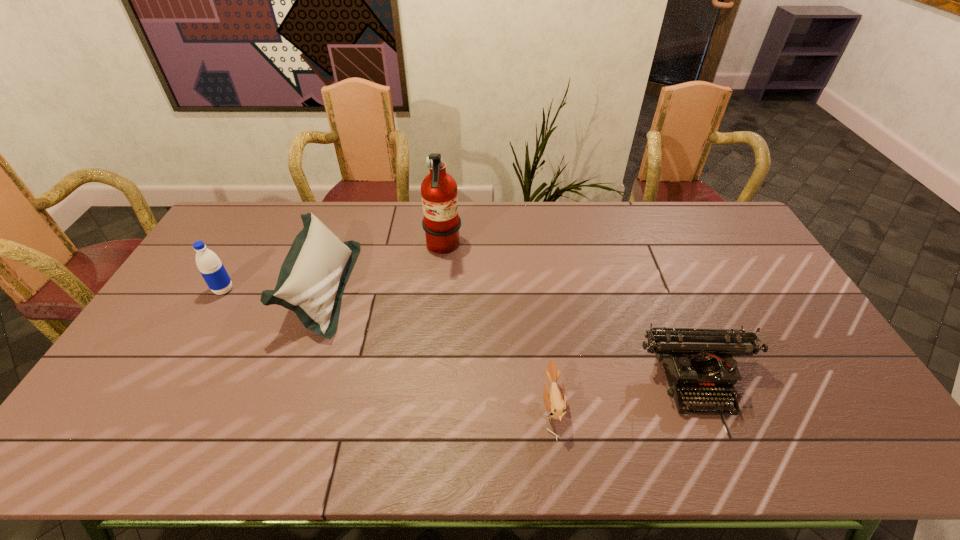
Locate an element on the screen. the tallest object is located at coordinates (441, 223).

Where is `fire extinguisher`? The image size is (960, 540). fire extinguisher is located at coordinates (441, 223).

I want to click on water bottle, so click(x=211, y=268).

Identify the location of cushion. (312, 278).

You are a GUI agent. You are given a task and a screenshot of the screen. Output one action in this format:
    pyautogui.click(x=<x>, y=<y>)
    Task: Click on the second shortest object
    The image size is (960, 540).
    Given the screenshot: What is the action you would take?
    pyautogui.click(x=695, y=361)

Find the location of a particular element. The height and width of the screenshot is (540, 960). the rightmost object is located at coordinates (695, 361).

Where is `the fourth object from left to right`? The width and height of the screenshot is (960, 540). the fourth object from left to right is located at coordinates (555, 402).

The width and height of the screenshot is (960, 540). I want to click on the shortest object, so click(555, 402).

You are a GUI agent. You are given a task and a screenshot of the screen. Output one action in this format:
    pyautogui.click(x=<x>, y=<y>)
    Task: Click on the vacant position located 0.190m on the nozzle and handle of the fire extinguisher
    The image size is (960, 540).
    Given the screenshot: What is the action you would take?
    pyautogui.click(x=516, y=248)

Where is `vacant space situated on the front of the leftmost object`? This screenshot has width=960, height=540. vacant space situated on the front of the leftmost object is located at coordinates (197, 335).